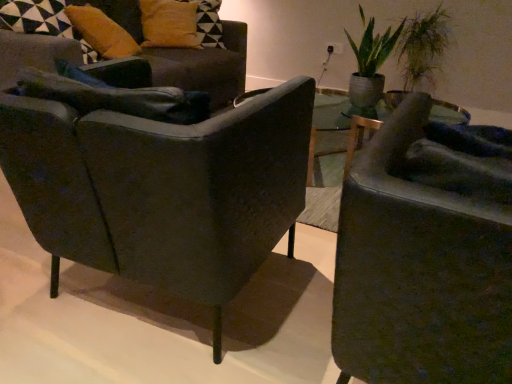
This screenshot has height=384, width=512. What do you see at coordinates (102, 32) in the screenshot?
I see `mustard yellow fabric pillow at upper left, which appears as the 1th pillow when viewed from the front` at bounding box center [102, 32].

This screenshot has height=384, width=512. I want to click on matte black armchair at left, acting as the 2th chair starting from the back, so click(162, 189).

This screenshot has height=384, width=512. What are the coordinates of `matte yellow pillow at upper left, marked as the 1th pillow in a back-to-front arrangement` in the screenshot? It's located at (169, 24).

Image resolution: width=512 pixels, height=384 pixels. Describe the element at coordinates (169, 24) in the screenshot. I see `matte yellow pillow at upper left, marked as the 1th pillow in a back-to-front arrangement` at that location.

Measure the distance between point (x=416, y=340) and camera.

Point (x=416, y=340) and camera are 29.06 inches apart.

What are the coordinates of `matte black armchair at right, arranged as the 3th chair when viewed from the back` in the screenshot? It's located at (419, 272).

The height and width of the screenshot is (384, 512). What do you see at coordinates (370, 62) in the screenshot?
I see `green leafy plant at upper right` at bounding box center [370, 62].

Measure the distance between green leafy plant at upper right and camera.

green leafy plant at upper right and camera are 7.09 feet apart from each other.

This screenshot has height=384, width=512. Identify the location of mustard yellow fabric pillow at upper left, which appears as the 1th pillow when viewed from the front. (102, 32).

From the image's perspective, relative to matte black armchair at right, arranged as the 3th chair when viewed from the back, is mustard yellow fabric pillow at upper left, arranged as the 2th pillow when viewed from the back, above or below?

mustard yellow fabric pillow at upper left, arranged as the 2th pillow when viewed from the back, is situated higher than matte black armchair at right, arranged as the 3th chair when viewed from the back, in the image.

Is mustard yellow fabric pillow at upper left, arranged as the 2th pillow when viewed from the back, next to matte black armchair at right, arranged as the 3th chair when viewed from the back, and touching it?

mustard yellow fabric pillow at upper left, arranged as the 2th pillow when viewed from the back, is not next to matte black armchair at right, arranged as the 3th chair when viewed from the back, and they're not touching.

Is mustard yellow fabric pillow at upper left, which appears as the 1th pillow when viewed from the front, positioned beyond the bounds of matte black armchair at right, arranged as the 3th chair when viewed from the back?

Yes, mustard yellow fabric pillow at upper left, which appears as the 1th pillow when viewed from the front, is not within matte black armchair at right, arranged as the 3th chair when viewed from the back.

I want to click on the 3rd chair below the mustard yellow fabric pillow at upper left, arranged as the 2th pillow when viewed from the back (from the image's perspective), so click(419, 272).

Is mustard yellow fabric pillow at upper left, which appears as the 1th pillow when viewed from the front, to the left or to the right of green leafy plant at upper right in the image?

From the image, it's evident that mustard yellow fabric pillow at upper left, which appears as the 1th pillow when viewed from the front, is to the left of green leafy plant at upper right.

Could you tell me if mustard yellow fabric pillow at upper left, arranged as the 2th pillow when viewed from the back, is facing green leafy plant at upper right?

Yes, mustard yellow fabric pillow at upper left, arranged as the 2th pillow when viewed from the back, faces towards green leafy plant at upper right.

From the image's perspective, is mustard yellow fabric pillow at upper left, which appears as the 1th pillow when viewed from the front, above or below green leafy plant at upper right?

Clearly, from the image's perspective, mustard yellow fabric pillow at upper left, which appears as the 1th pillow when viewed from the front, is above green leafy plant at upper right.

Considering the relative positions of matte yellow pillow at upper left, marked as the 1th pillow in a back-to-front arrangement, and green leafy plant at upper right in the image provided, is matte yellow pillow at upper left, marked as the 1th pillow in a back-to-front arrangement, to the left of green leafy plant at upper right from the viewer's perspective?

Yes, matte yellow pillow at upper left, marked as the 1th pillow in a back-to-front arrangement, is to the left of green leafy plant at upper right.

Based on the photo, from a real-world perspective, which is physically below, matte yellow pillow at upper left, marked as the 1th pillow in a back-to-front arrangement, or green leafy plant at upper right?

green leafy plant at upper right is physically lower.

From the image's perspective, would you say matte yellow pillow at upper left, which is the second pillow from front to back, is shown under green leafy plant at upper right?

No.

Can you confirm if matte yellow pillow at upper left, which is the second pillow from front to back, is shorter than green leafy plant at upper right?

Yes, matte yellow pillow at upper left, which is the second pillow from front to back, is shorter than green leafy plant at upper right.

Considering the sizes of matte black armchair at left, the second chair from the front, and green leafy plant at upper right in the image, is matte black armchair at left, the second chair from the front, taller or shorter than green leafy plant at upper right?

Clearly, matte black armchair at left, the second chair from the front, is shorter compared to green leafy plant at upper right.

Which object is positioned more to the left, matte black armchair at left, acting as the 2th chair starting from the back, or green leafy plant at upper right?

Positioned to the left is matte black armchair at left, acting as the 2th chair starting from the back.

From the picture: Is matte black armchair at left, the second chair from the front, not within green leafy plant at upper right?

matte black armchair at left, the second chair from the front, lies outside green leafy plant at upper right's area.

Is matte black armchair at left, acting as the 2th chair starting from the back, positioned far away from green leafy plant at upper right?

Yes, matte black armchair at left, acting as the 2th chair starting from the back, is far from green leafy plant at upper right.

Considering the sizes of objects mustard yellow fabric pillow at upper left, which appears as the 1th pillow when viewed from the front, and matte black armchair at left, arranged as the 3th chair when viewed from the front, in the image provided, who is taller, mustard yellow fabric pillow at upper left, which appears as the 1th pillow when viewed from the front, or matte black armchair at left, arranged as the 3th chair when viewed from the front,?

With more height is matte black armchair at left, arranged as the 3th chair when viewed from the front.

Is point (123, 52) farther from viewer compared to point (66, 40)?

Yes, point (123, 52) is farther from viewer.

What are the coordinates of `chair that is the 1st one when counting rightward from the mustard yellow fabric pillow at upper left, arranged as the 2th pillow when viewed from the back` in the screenshot? It's located at (205, 66).

Considering the relative positions of mustard yellow fabric pillow at upper left, which appears as the 1th pillow when viewed from the front, and matte black armchair at left, the 1th chair in the back-to-front sequence, in the image provided, is mustard yellow fabric pillow at upper left, which appears as the 1th pillow when viewed from the front, in front of matte black armchair at left, the 1th chair in the back-to-front sequence,?

No, the depth of mustard yellow fabric pillow at upper left, which appears as the 1th pillow when viewed from the front, is greater than that of matte black armchair at left, the 1th chair in the back-to-front sequence.

Visually, is matte black armchair at left, the second chair from the front, positioned to the left or to the right of green leafy plant at upper right?

matte black armchair at left, the second chair from the front, is to the left of green leafy plant at upper right.

Consider the image. Is matte black armchair at left, acting as the 2th chair starting from the back, behind green leafy plant at upper right?

No, the depth of matte black armchair at left, acting as the 2th chair starting from the back, is less than that of green leafy plant at upper right.

Could green leafy plant at upper right be considered to be inside matte black armchair at left, the second chair from the front?

That's incorrect, green leafy plant at upper right is not inside matte black armchair at left, the second chair from the front.

From a real-world perspective, which is physically below, matte black armchair at right, the first chair positioned from the front, or green leafy plant at upper right?

In real-world perspective, matte black armchair at right, the first chair positioned from the front, is lower.

Choose the correct answer: Is matte black armchair at right, the first chair positioned from the front, inside green leafy plant at upper right or outside it?

matte black armchair at right, the first chair positioned from the front, lies outside green leafy plant at upper right.

Is matte black armchair at right, the first chair positioned from the front, looking in the opposite direction of green leafy plant at upper right?

No, matte black armchair at right, the first chair positioned from the front, is not facing the opposite direction of green leafy plant at upper right.

You are a GUI agent. You are given a task and a screenshot of the screen. Output one action in this format:
    pyautogui.click(x=<x>, y=<y>)
    Task: Click on the 2nd pillow to the left when counting from the matte black armchair at right, arranged as the 3th chair when viewed from the back
    The width and height of the screenshot is (512, 384).
    Given the screenshot: What is the action you would take?
    pyautogui.click(x=102, y=32)

This screenshot has width=512, height=384. I want to click on houseplant below the mustard yellow fabric pillow at upper left, arranged as the 2th pillow when viewed from the back (from the image's perspective), so click(x=370, y=62).

Considering their positions, is mustard yellow fabric pillow at upper left, which appears as the 1th pillow when viewed from the front, positioned closer to matte black armchair at left, the second chair from the front, than matte yellow pillow at upper left, marked as the 1th pillow in a back-to-front arrangement?

The object closer to matte black armchair at left, the second chair from the front, is mustard yellow fabric pillow at upper left, which appears as the 1th pillow when viewed from the front.

Looking at the image, which one is located further to matte yellow pillow at upper left, marked as the 1th pillow in a back-to-front arrangement, mustard yellow fabric pillow at upper left, arranged as the 2th pillow when viewed from the back, or matte black armchair at left, the second chair from the front?

Among the two, matte black armchair at left, the second chair from the front, is located further to matte yellow pillow at upper left, marked as the 1th pillow in a back-to-front arrangement.

When comparing their distances from matte black armchair at left, arranged as the 3th chair when viewed from the front, does mustard yellow fabric pillow at upper left, which appears as the 1th pillow when viewed from the front, or green leafy plant at upper right seem closer?

The object closer to matte black armchair at left, arranged as the 3th chair when viewed from the front, is mustard yellow fabric pillow at upper left, which appears as the 1th pillow when viewed from the front.

Looking at the image, which one is located closer to matte yellow pillow at upper left, which is the second pillow from front to back, matte black armchair at right, arranged as the 3th chair when viewed from the back, or mustard yellow fabric pillow at upper left, which appears as the 1th pillow when viewed from the front?

Among the two, mustard yellow fabric pillow at upper left, which appears as the 1th pillow when viewed from the front, is located nearer to matte yellow pillow at upper left, which is the second pillow from front to back.

When comparing their distances from mustard yellow fabric pillow at upper left, which appears as the 1th pillow when viewed from the front, does matte yellow pillow at upper left, marked as the 1th pillow in a back-to-front arrangement, or green leafy plant at upper right seem closer?

matte yellow pillow at upper left, marked as the 1th pillow in a back-to-front arrangement, is positioned closer to the anchor mustard yellow fabric pillow at upper left, which appears as the 1th pillow when viewed from the front.

Considering their positions, is matte black armchair at right, the first chair positioned from the front, positioned closer to matte yellow pillow at upper left, marked as the 1th pillow in a back-to-front arrangement, than green leafy plant at upper right?

green leafy plant at upper right lies closer to matte yellow pillow at upper left, marked as the 1th pillow in a back-to-front arrangement, than the other object.

Estimate the real-world distances between objects in this image. Which object is further from matte black armchair at right, the first chair positioned from the front, green leafy plant at upper right or matte black armchair at left, the second chair from the front?

green leafy plant at upper right.

Looking at the image, which one is located closer to mustard yellow fabric pillow at upper left, arranged as the 2th pillow when viewed from the back, green leafy plant at upper right or matte black armchair at left, the 1th chair in the back-to-front sequence?

The object closer to mustard yellow fabric pillow at upper left, arranged as the 2th pillow when viewed from the back, is matte black armchair at left, the 1th chair in the back-to-front sequence.

This screenshot has width=512, height=384. Identify the location of houseplant positioned between matte black armchair at right, arranged as the 3th chair when viewed from the back, and green leafy plant at upper right from near to far. pyautogui.click(x=370, y=62).

I want to click on houseplant positioned between matte black armchair at right, arranged as the 3th chair when viewed from the back, and mustard yellow fabric pillow at upper left, which appears as the 1th pillow when viewed from the front, from near to far, so click(370, 62).

Where is `plant between matte black armchair at right, arranged as the 3th chair when viewed from the back, and matte yellow pillow at upper left, marked as the 1th pillow in a back-to-front arrangement, along the z-axis`? This screenshot has height=384, width=512. plant between matte black armchair at right, arranged as the 3th chair when viewed from the back, and matte yellow pillow at upper left, marked as the 1th pillow in a back-to-front arrangement, along the z-axis is located at coordinates (423, 48).

Identify the location of houseplant between matte black armchair at right, the first chair positioned from the front, and matte yellow pillow at upper left, marked as the 1th pillow in a back-to-front arrangement, from front to back. The width and height of the screenshot is (512, 384). (370, 62).